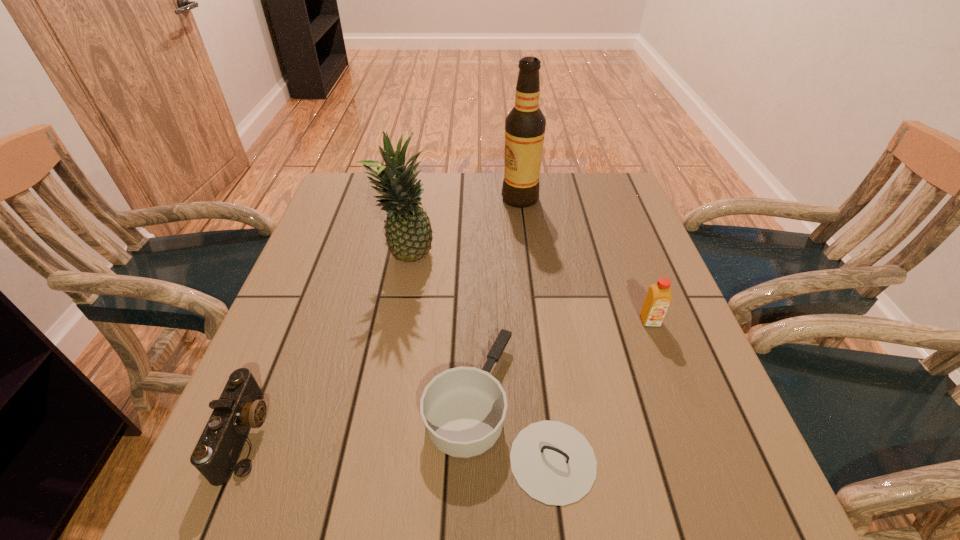
Find the location of `object at the right edge`. object at the right edge is located at coordinates (659, 296).

Image resolution: width=960 pixels, height=540 pixels. In order to click on object that is at the near left corner in this screenshot , I will do click(x=240, y=407).

In the image, there is a desktop. Where is `free space at the far edge`? The width and height of the screenshot is (960, 540). free space at the far edge is located at coordinates (560, 193).

Where is `vacant space at the near edge`? vacant space at the near edge is located at coordinates (345, 489).

In the image, there is a desktop. Where is `free space at the left edge`? The image size is (960, 540). free space at the left edge is located at coordinates (348, 314).

In the image, there is a desktop. What are the coordinates of `vacant area at the right edge` in the screenshot? It's located at (697, 459).

Image resolution: width=960 pixels, height=540 pixels. I want to click on vacant area at the far left corner of the desktop, so click(x=363, y=193).

In order to click on free spot at the far right corner of the desktop in this screenshot , I will do `click(619, 177)`.

The height and width of the screenshot is (540, 960). In the image, there is a desktop. In order to click on blank space at the near right corner in this screenshot , I will do `click(686, 518)`.

At what (x,y) coordinates should I click in order to perform the action: click on vacant region between the alcohol and the leftmost object. Please return your answer as a coordinate pair (x, y). The width and height of the screenshot is (960, 540). Looking at the image, I should click on (383, 316).